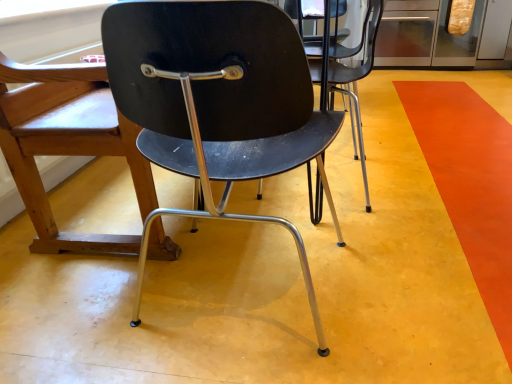
I want to click on free space to the left of matte black chair at center, the 2th chair from the back, so click(81, 311).